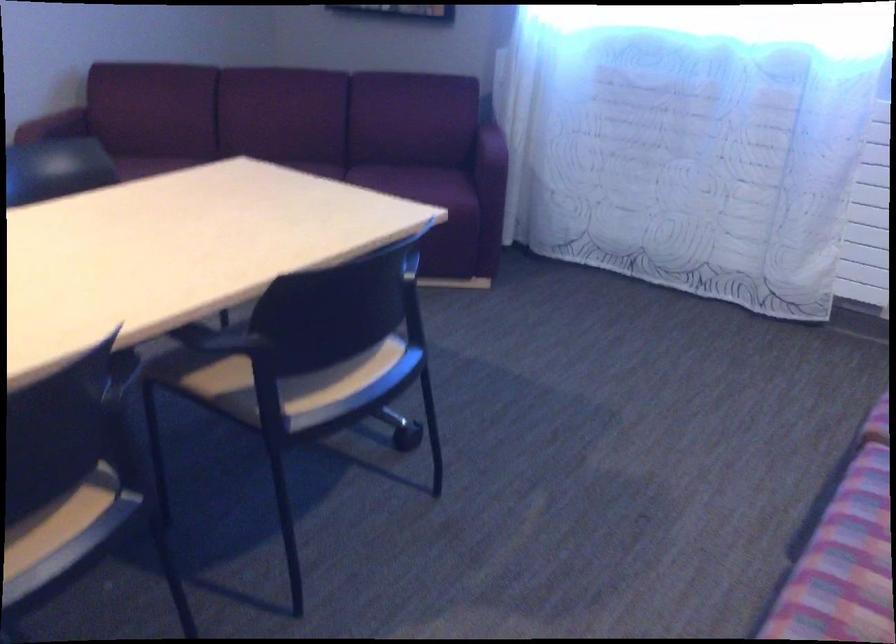
This screenshot has width=896, height=644. In order to click on black chair armrest in this screenshot , I will do `click(391, 418)`.